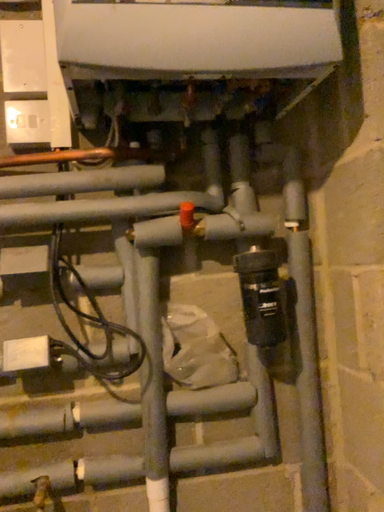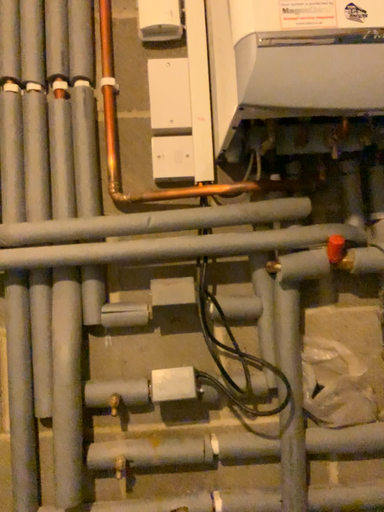
Question: Which way did the camera rotate in the video?

Choices:
 (A) rotated left
 (B) rotated right

Answer: (A)